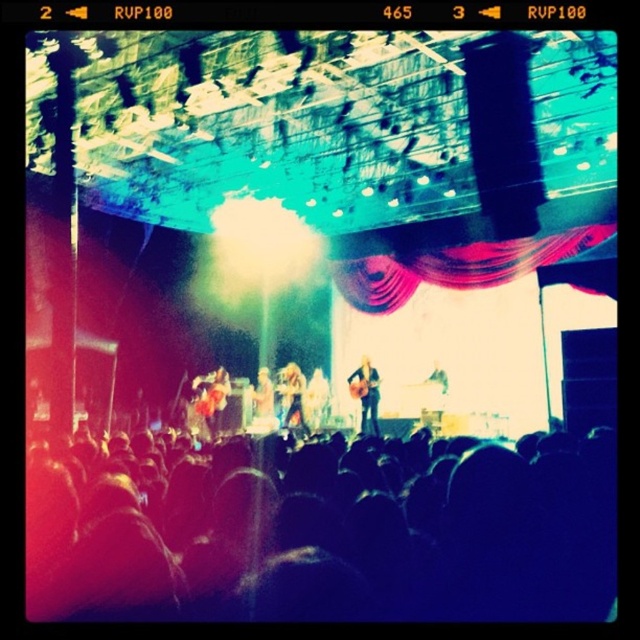
Question: Is shiny red guitar at center above shiny silver guitar at center?

Choices:
 (A) no
 (B) yes

Answer: (B)

Question: Considering the real-world distances, which object is farthest from the smooth skin figure at center?

Choices:
 (A) wooden acoustic guitar at center
 (B) black matte crowd at lower center
 (C) shiny silver guitar at center

Answer: (B)

Question: Which is nearer to the shiny red guitar at center?

Choices:
 (A) shiny silver guitar at center
 (B) pink satin curtain at center
 (C) wooden acoustic guitar at center

Answer: (A)

Question: Which of the following is the closest to the observer?

Choices:
 (A) black matte crowd at lower center
 (B) wooden acoustic guitar at center
 (C) shiny red guitar at center
 (D) shiny silver guitar at center

Answer: (A)

Question: Is the position of pink satin curtain at center less distant than that of shiny silver guitar at center?

Choices:
 (A) no
 (B) yes

Answer: (B)

Question: Does pink satin curtain at center have a greater width compared to wooden acoustic guitar at center?

Choices:
 (A) no
 (B) yes

Answer: (B)